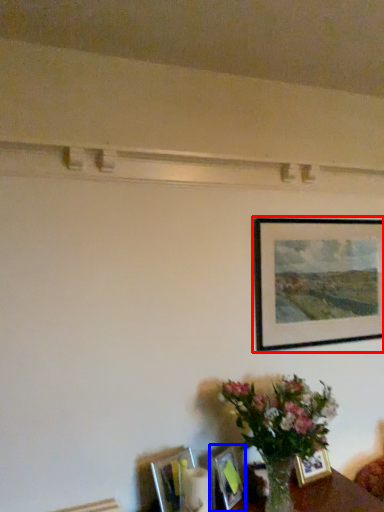
Question: Among these objects, which one is nearest to the camera, picture frame (highlighted by a red box) or picture frame (highlighted by a blue box)?

Choices:
 (A) picture frame
 (B) picture frame

Answer: (B)